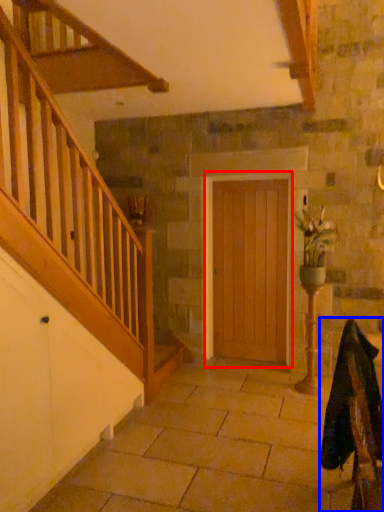
Question: Which point is closer to the camera, door (highlighted by a red box) or rocking chair (highlighted by a blue box)?

Choices:
 (A) door
 (B) rocking chair

Answer: (B)